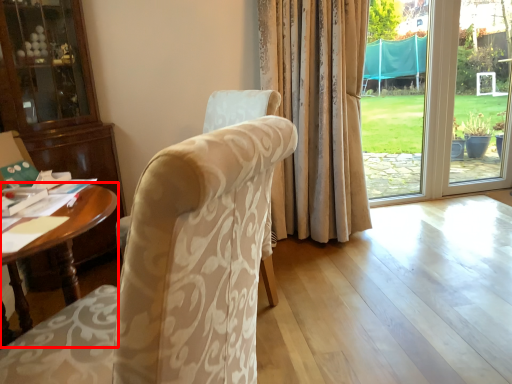
Question: Observing the image, what is the correct spatial positioning of desk (annotated by the red box) in reference to chair?

Choices:
 (A) left
 (B) right

Answer: (A)